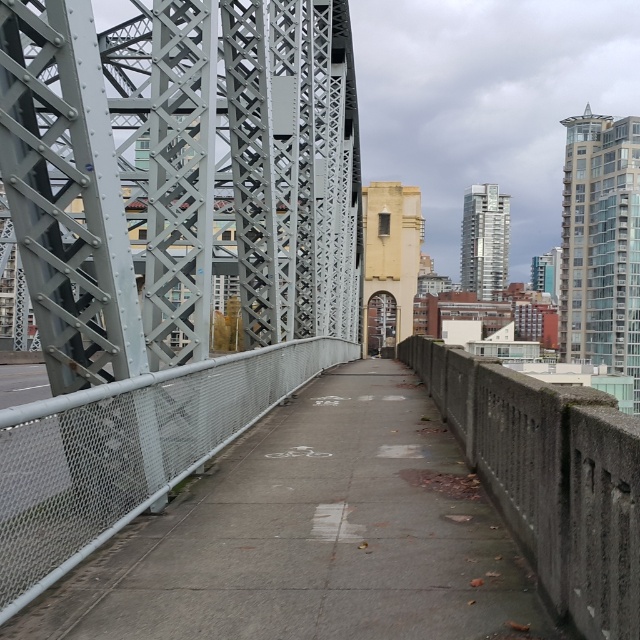
What do you see at coordinates (164, 244) in the screenshot? This screenshot has height=640, width=640. I see `metallic gray bridge at center` at bounding box center [164, 244].

Consider the image. Can you confirm if metallic gray bridge at center is positioned to the left of gray concrete pavement at center?

Correct, you'll find metallic gray bridge at center to the left of gray concrete pavement at center.

Does point (45, 365) come closer to viewer compared to point (188, 496)?

Yes, point (45, 365) is closer to viewer.

This screenshot has height=640, width=640. Identify the location of metallic gray bridge at center. (164, 244).